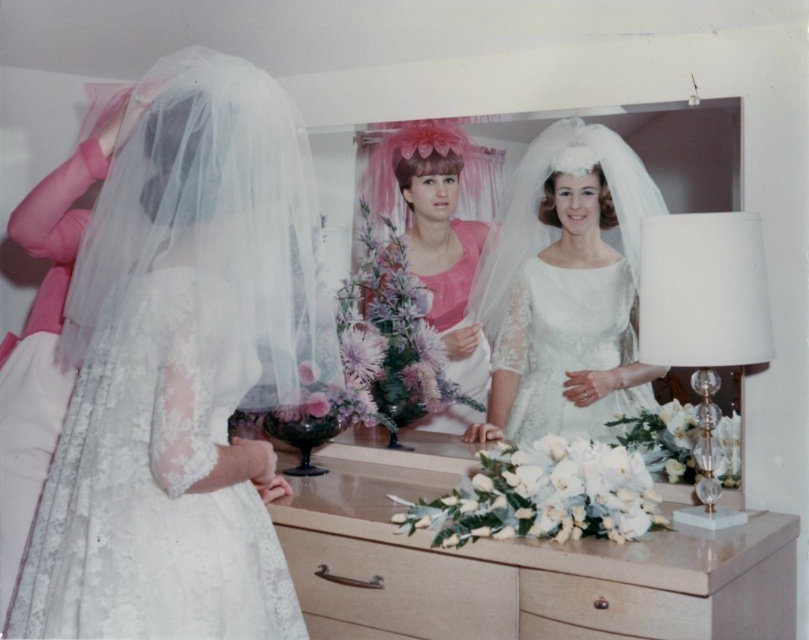
You are a photographer setting up a shot in this scene. You need to place a small prop between the pink satin dress at center and the beige wood drawer at lower center. Based on their positions, which object should the prop be closer to?

The prop should be placed closer to the beige wood drawer at lower center because the pink satin dress at center is further away from the viewer, meaning the drawer is closer to the prop placement area.

You are a photographer setting up for a wedding photoshoot. You need to place a small bouquet of flowers on the wooden dresser at center and the light wood drawer at lower center. Which surface can accommodate the bouquet without it falling off due to height differences?

The wooden dresser at center is much taller than the light wood drawer at lower center, so placing the bouquet on the wooden dresser at center would be safer as it offers a more stable height.

Consider the image. Where is the lace fabric dress at center located in the image?

The lace fabric dress at center is located at point (181, 369).